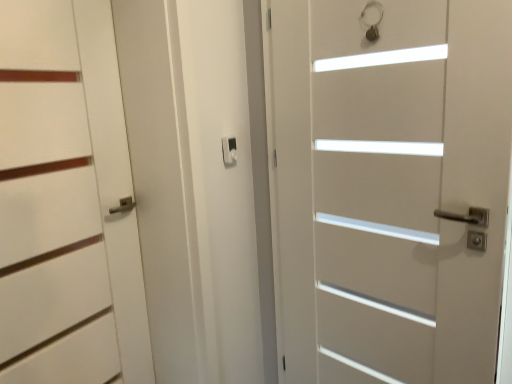
Question: In terms of height, does matte black latch at center look taller or shorter compared to white matte door at left, positioned as the second door in right-to-left order?

Choices:
 (A) tall
 (B) short

Answer: (B)

Question: Considering the positions of point (233, 147) and point (100, 198), is point (233, 147) closer or farther from the camera than point (100, 198)?

Choices:
 (A) closer
 (B) farther

Answer: (B)

Question: Which is farther from the white matte door at center, which is counted as the 2th door, starting from the left?

Choices:
 (A) white matte door at left, positioned as the second door in right-to-left order
 (B) matte black latch at center

Answer: (A)

Question: Based on their relative distances, which object is nearer to the white matte door at left, which ranks as the 1th door in left-to-right order?

Choices:
 (A) white matte door at center, which is counted as the 2th door, starting from the left
 (B) matte black latch at center

Answer: (B)